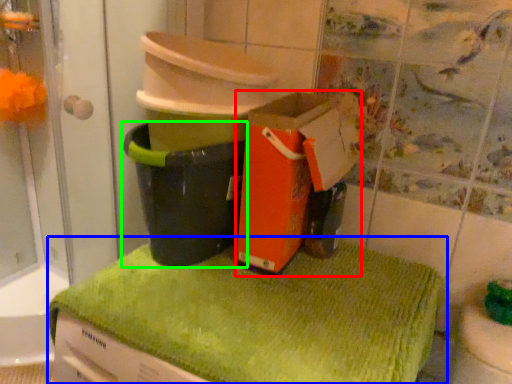
Question: Which object is the closest to the cardboard box (highlighted by a red box)? Choose among these: bath towel (highlighted by a blue box) or waste container (highlighted by a green box).

Choices:
 (A) bath towel
 (B) waste container

Answer: (B)